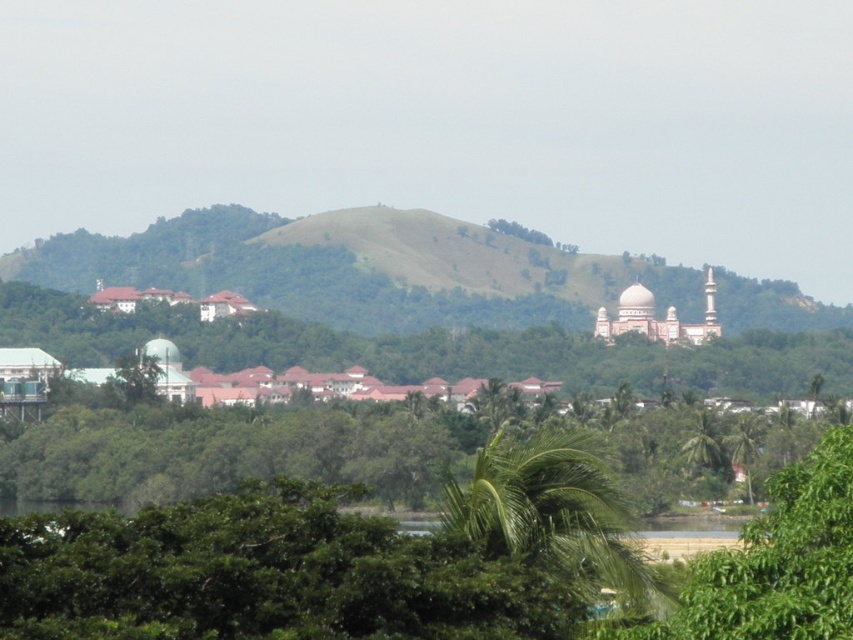
Question: Is green leafy tree at center positioned at the back of green leafy palm at center?

Choices:
 (A) no
 (B) yes

Answer: (B)

Question: Which object is the farthest from the green leafy palm at center?

Choices:
 (A) green grassy hillside at center
 (B) green leafy tree at center

Answer: (B)

Question: Does green leafy tree at center appear on the right side of green leafy palm at center?

Choices:
 (A) no
 (B) yes

Answer: (A)

Question: Estimate the real-world distances between objects in this image. Which object is closer to the green grassy hillside at center?

Choices:
 (A) green leafy tree at center
 (B) green leafy palm at center

Answer: (A)

Question: Which is nearer to the green leafy tree at center?

Choices:
 (A) green grassy hillside at center
 (B) green leafy palm at center

Answer: (A)

Question: Is the position of green leafy tree at center more distant than that of green leafy palm at center?

Choices:
 (A) no
 (B) yes

Answer: (B)